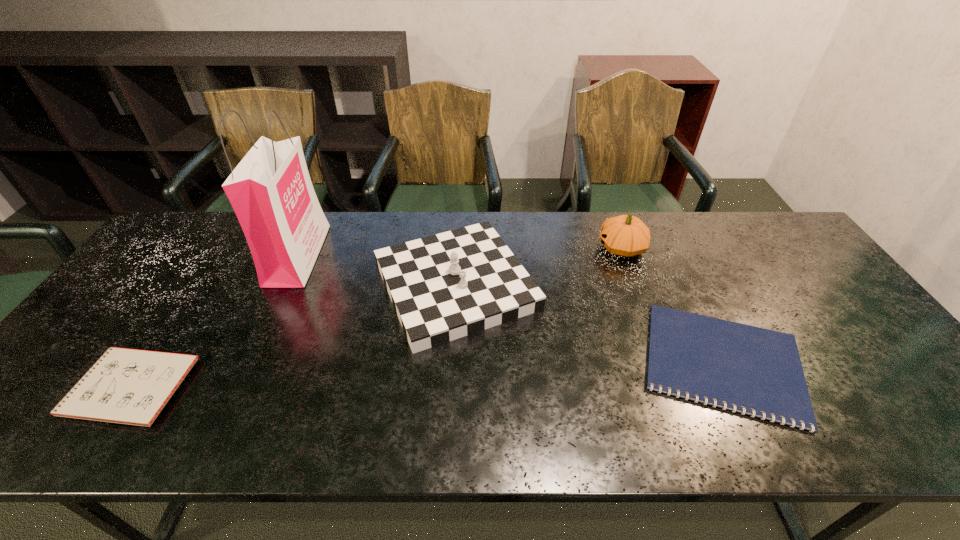
The image size is (960, 540). Find the location of `free space located on the side of the gourd with the carved face`. free space located on the side of the gourd with the carved face is located at coordinates (504, 248).

Where is `vacant space located on the side of the gourd with the carved face`? The image size is (960, 540). vacant space located on the side of the gourd with the carved face is located at coordinates point(526,248).

Identify the location of free space located 0.290m on the right of the third object from right to left. (642, 285).

You are a GUI agent. You are given a task and a screenshot of the screen. Output one action in this format:
    pyautogui.click(x=<x>, y=<y>)
    Task: Click on the free space located on the back of the fourth tallest object
    The width and height of the screenshot is (960, 540).
    Given the screenshot: What is the action you would take?
    pyautogui.click(x=197, y=287)

Where is `vacant point located 0.060m on the back of the shorter notepad`? The width and height of the screenshot is (960, 540). vacant point located 0.060m on the back of the shorter notepad is located at coordinates (688, 292).

This screenshot has height=540, width=960. In order to click on shopping bag positioned at the far edge in this screenshot , I will do `click(270, 190)`.

Find the location of a particular element. The height and width of the screenshot is (540, 960). gourd that is at the far edge is located at coordinates (625, 235).

I want to click on checkerboard at the far edge, so click(x=446, y=286).

Locate an element on the screen. The image size is (960, 540). object positioned at the left edge is located at coordinates (128, 386).

Locate an element on the screen. This screenshot has width=960, height=540. object at the near left corner is located at coordinates [x=128, y=386].